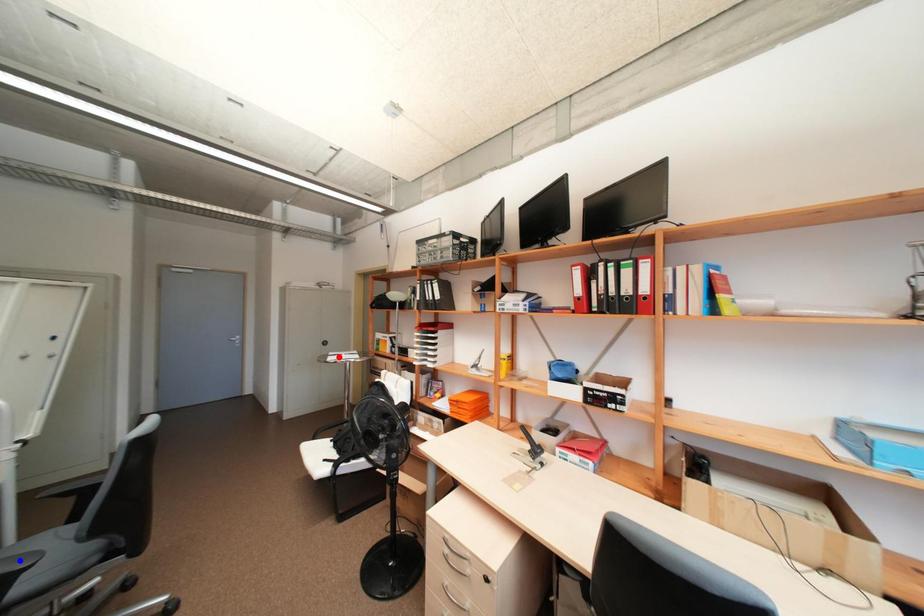
Question: In the image, two points are highlighted. Which point is nearer to the camera? Reply with the corresponding letter.

Choices:
 (A) blue point
 (B) red point

Answer: (A)